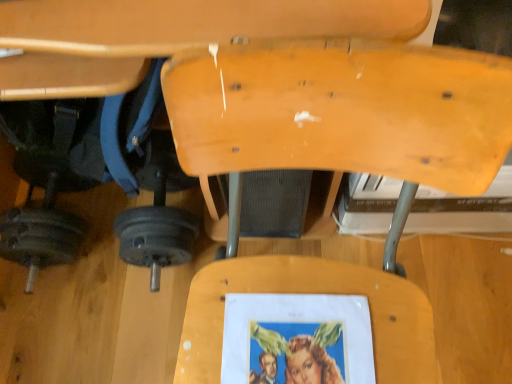
Question: Relative to dark gray metallic barbell at lower left, is wooden swivel chair at center in front or behind?

Choices:
 (A) front
 (B) behind

Answer: (A)

Question: Which is correct: wooden swivel chair at center is inside dark gray metallic barbell at lower left, or outside of it?

Choices:
 (A) inside
 (B) outside

Answer: (B)

Question: Considering the positions of wooden swivel chair at center and dark gray metallic barbell at lower left in the image, is wooden swivel chair at center wider or thinner than dark gray metallic barbell at lower left?

Choices:
 (A) thin
 (B) wide

Answer: (B)

Question: Is point (29, 208) closer or farther from the camera than point (326, 86)?

Choices:
 (A) closer
 (B) farther

Answer: (B)

Question: From the image's perspective, relative to wooden swivel chair at center, is dark gray metallic barbell at lower left above or below?

Choices:
 (A) above
 (B) below

Answer: (B)

Question: From a real-world perspective, is dark gray metallic barbell at lower left physically located above or below wooden swivel chair at center?

Choices:
 (A) above
 (B) below

Answer: (B)

Question: Based on their sizes in the image, would you say dark gray metallic barbell at lower left is bigger or smaller than wooden swivel chair at center?

Choices:
 (A) big
 (B) small

Answer: (B)